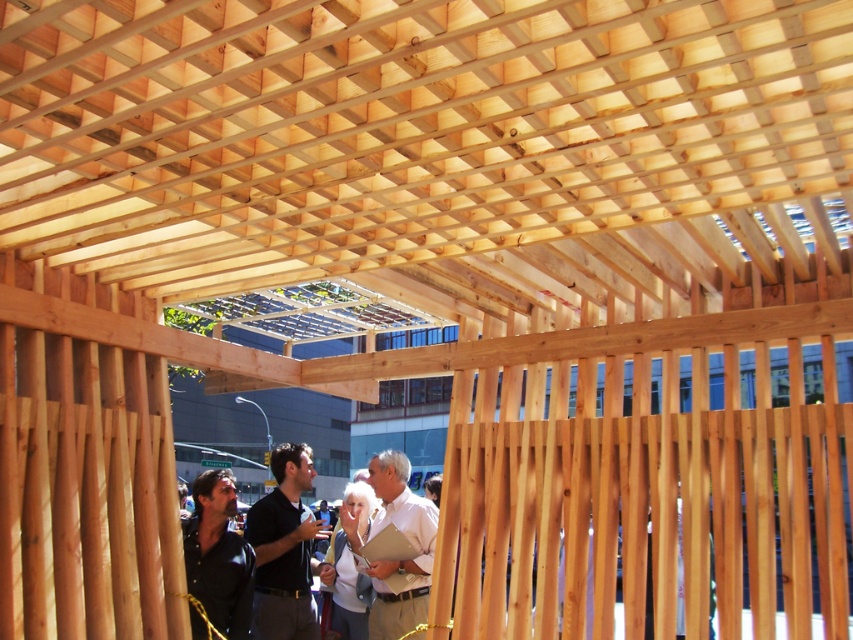
Question: Can you confirm if black shirt at center is bigger than dark brown leather jacket at lower left?

Choices:
 (A) no
 (B) yes

Answer: (B)

Question: Is white matte shirt at center to the left of dark brown leather jacket at lower left from the viewer's perspective?

Choices:
 (A) yes
 (B) no

Answer: (B)

Question: Estimate the real-world distances between objects in this image. Which object is closer to the white matte shirt at center?

Choices:
 (A) black shirt at center
 (B) dark brown leather jacket at lower left

Answer: (A)

Question: Which point is closer to the camera?

Choices:
 (A) dark brown leather jacket at lower left
 (B) white matte shirt at center
 (C) black shirt at center

Answer: (A)

Question: Which object appears closest to the camera in this image?

Choices:
 (A) dark brown leather jacket at lower left
 (B) black shirt at center
 (C) white matte shirt at center

Answer: (A)

Question: Can you confirm if black shirt at center is positioned to the left of dark brown leather jacket at lower left?

Choices:
 (A) yes
 (B) no

Answer: (B)